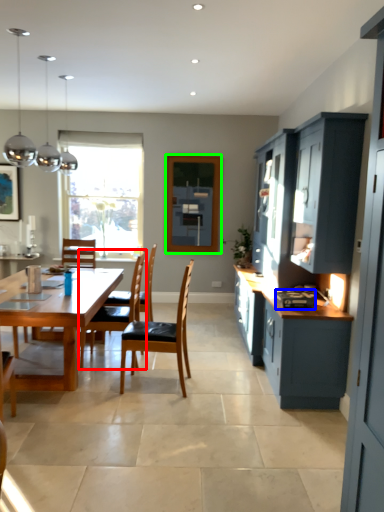
Question: Based on their relative distances, which object is nearer to chair (highlighted by a red box)? Choose from appliance (highlighted by a blue box) and window screen (highlighted by a green box).

Choices:
 (A) appliance
 (B) window screen

Answer: (A)